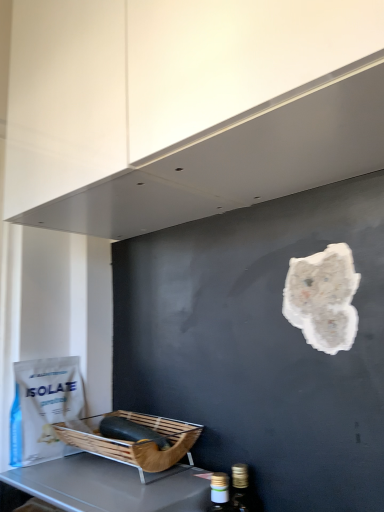
Find the location of a particular element. vacant area that is in front of brown woven basket at lower left is located at coordinates (108, 489).